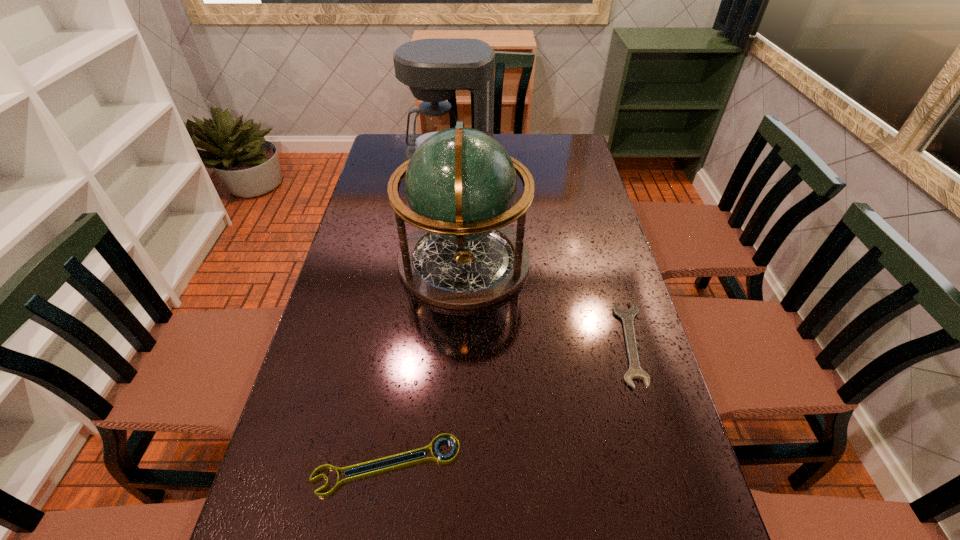
Find the location of `globe`. globe is located at coordinates (461, 184).

Identify the location of coffee maker. This screenshot has width=960, height=540. (434, 69).

Where is `the rightmost object`? The height and width of the screenshot is (540, 960). the rightmost object is located at coordinates (627, 316).

The width and height of the screenshot is (960, 540). In order to click on the farther wrench in this screenshot , I will do `click(627, 316)`.

At what (x,y) coordinates should I click in order to perform the action: click on the left wrench. Please return your answer as a coordinate pair (x, y). Looking at the image, I should click on (444, 437).

In order to click on the nearest object in this screenshot , I will do `click(444, 437)`.

You are a GUI agent. You are given a task and a screenshot of the screen. Output one action in this format:
    pyautogui.click(x=<x>, y=<y>)
    Task: Click on the vacant space situated on the front-facing side of the globe
    The width and height of the screenshot is (960, 540).
    Given the screenshot: What is the action you would take?
    pyautogui.click(x=593, y=261)

Where is `free space located on the button side of the coffee maker`? The height and width of the screenshot is (540, 960). free space located on the button side of the coffee maker is located at coordinates (446, 212).

Where is `vacant space situated 0.180m on the left of the rightmost object`? The image size is (960, 540). vacant space situated 0.180m on the left of the rightmost object is located at coordinates (538, 343).

Locate an element on the screen. Image resolution: width=960 pixels, height=540 pixels. free space located 0.140m on the right of the left wrench is located at coordinates (533, 465).